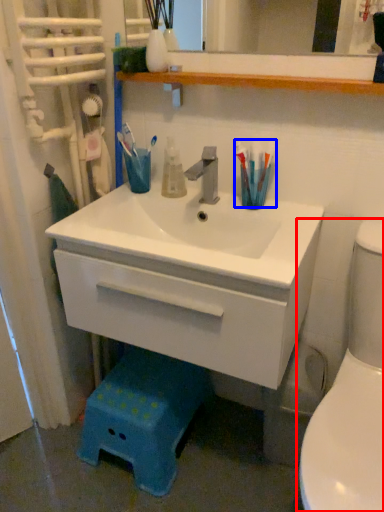
Question: Which point is closer to the camera, toilet (highlighted by a red box) or toothbrush (highlighted by a blue box)?

Choices:
 (A) toilet
 (B) toothbrush

Answer: (A)